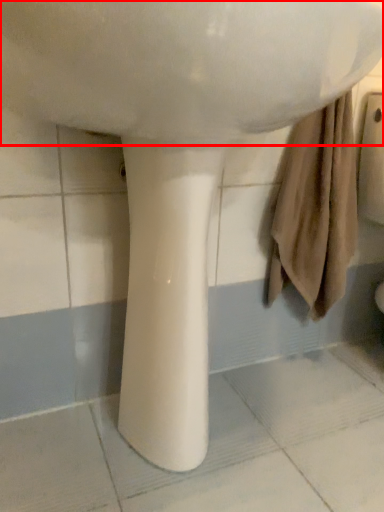
Question: In this image, where is sink (annotated by the red box) located relative to pillar?

Choices:
 (A) left
 (B) right

Answer: (B)